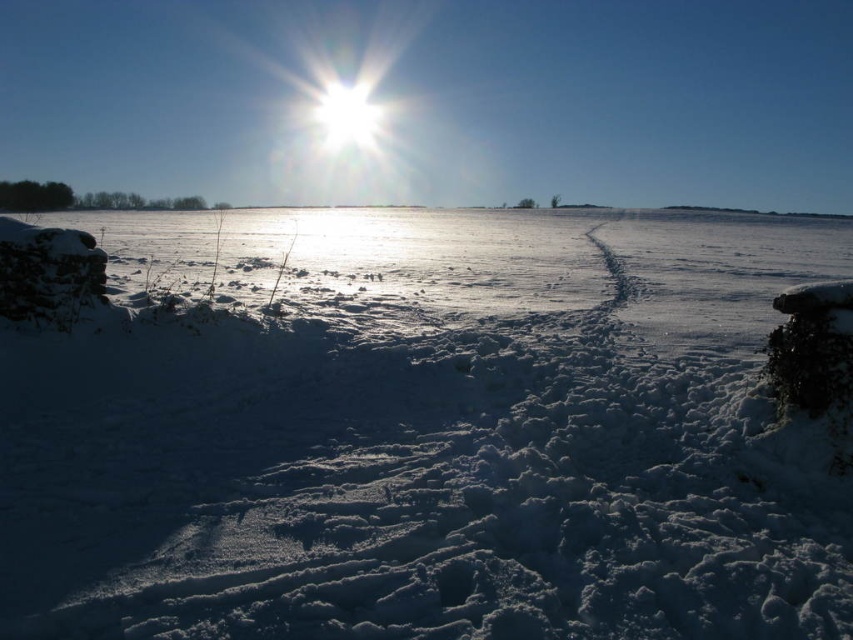
You are an astronaut on the moon and you see the white fluffy snow at center and the white glossy sun at upper center. Which object is closer to you?

The white fluffy snow at center is closer to you because it is shorter than the white glossy sun at upper center, which is further away.

You are planning to build a snowman using the white fluffy snow at center and the white glossy sun at upper center. Which material would be more suitable for the base of the snowman and why?

The white fluffy snow at center is more suitable for the base of the snowman because it has a greater width than the white glossy sun at upper center, making it a larger and more stable foundation.

You are an observer standing in the winter landscape. You see the white fluffy snow at center and the white glossy sun at upper center. Which object is located to the right of the other?

The white fluffy snow at center is positioned on the right side of white glossy sun at upper center.